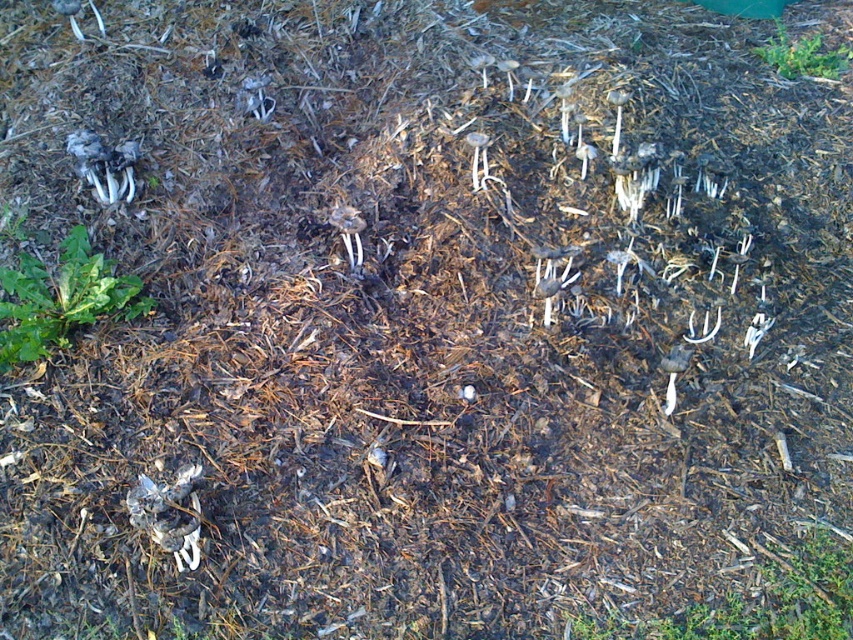
Question: Can you confirm if green leafy plant at lower left is positioned to the left of green leafy plant at upper right?

Choices:
 (A) no
 (B) yes

Answer: (B)

Question: Is green leafy plant at lower left below green leafy plant at upper right?

Choices:
 (A) yes
 (B) no

Answer: (A)

Question: Is green leafy plant at lower left above green leafy plant at upper right?

Choices:
 (A) yes
 (B) no

Answer: (B)

Question: Which point is farther to the camera?

Choices:
 (A) (80, 289)
 (B) (792, 54)

Answer: (B)